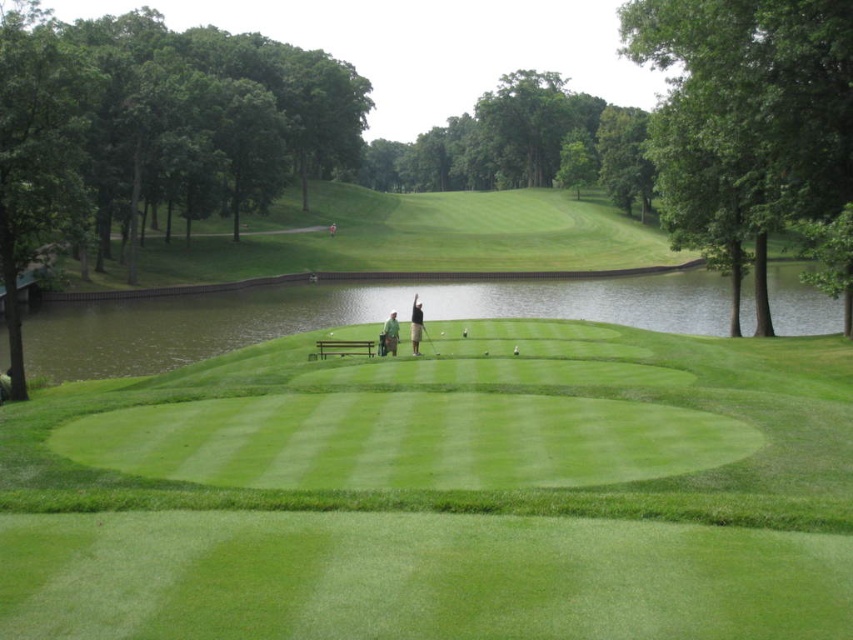
In the scene shown: You are standing on the putting green and see the green water at center and the green fabric shirt at center. Which object is closer to you?

The green water at center is closer to you than the green fabric shirt at center because it is further to the viewer.

You are standing at the edge of the putting green near the bench and want to determine the relative positions of two points marked on the ground. The points are labeled as point 1 at coordinates point (405, 291) and point 2 at coordinates point (386, 344). Which point is closer to you?

Point 1 at coordinates point (405, 291) is closer to you because it is further to the camera than point 2 at coordinates point (386, 344).